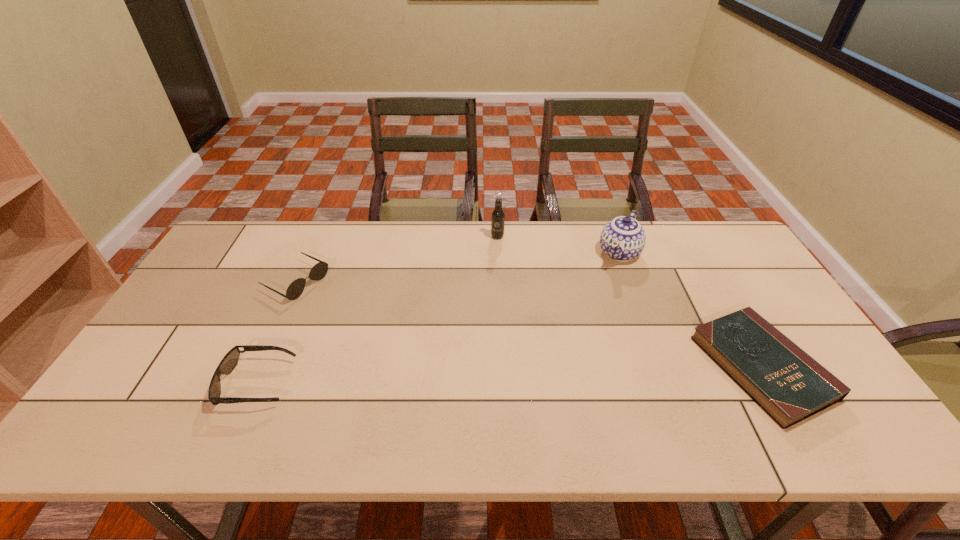
You are a GUI agent. You are given a task and a screenshot of the screen. Output one action in this format:
    pyautogui.click(x=<x>, y=<y>)
    Task: Click on the free space between the third tallest object and the Bible
    The image size is (960, 540).
    Given the screenshot: What is the action you would take?
    pyautogui.click(x=529, y=324)

Image resolution: width=960 pixels, height=540 pixels. In order to click on unoccupied position between the rightmost object and the tallest object in this screenshot , I will do 630,302.

This screenshot has height=540, width=960. Find the location of `object that is the third nearest to the nearer sunglasses`. object that is the third nearest to the nearer sunglasses is located at coordinates click(x=623, y=238).

Where is `object that is the closest to the taller sunglasses`? The height and width of the screenshot is (540, 960). object that is the closest to the taller sunglasses is located at coordinates (230, 360).

This screenshot has width=960, height=540. What are the coordinates of `free space that satisfies the following two spatial constraints: 1. on the front side of the third shortest object; 2. on the right side of the shortest object` in the screenshot? It's located at (257, 367).